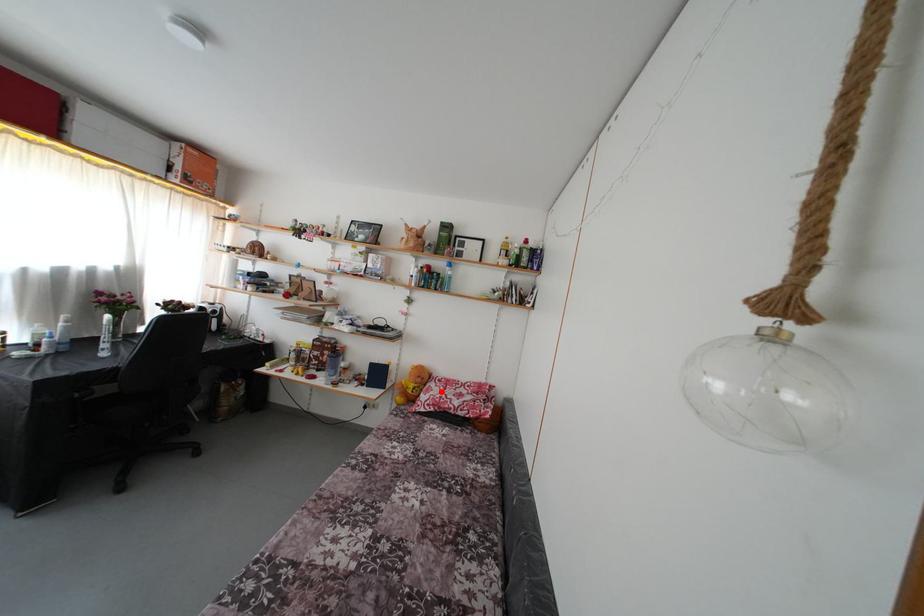
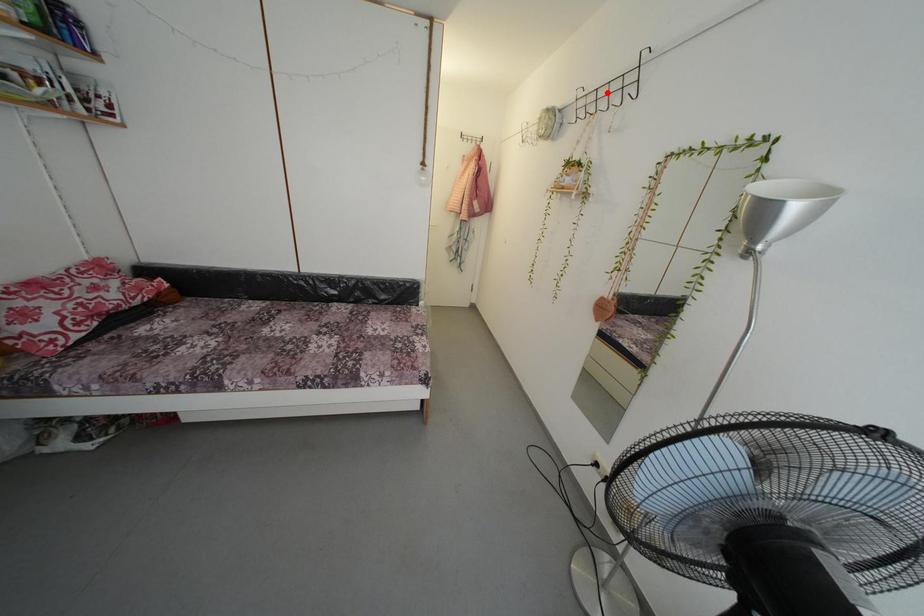
I am providing you with two images of the same scene from different viewpoints. A red point is marked on the first image and another point is marked on the second image. Is the red point in image1 aligned with the point shown in image2?

No